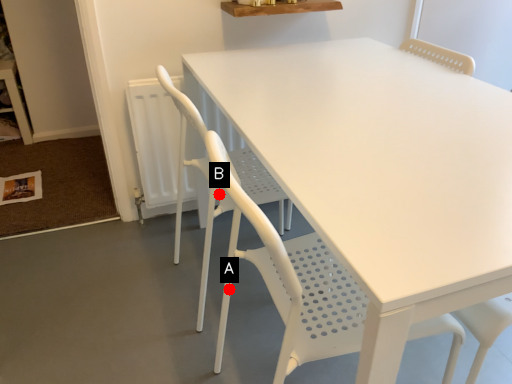
Question: Two points are circled on the image, labeled by A and B beside each circle. Which point is closer to the camera?

Choices:
 (A) A is closer
 (B) B is closer

Answer: (A)